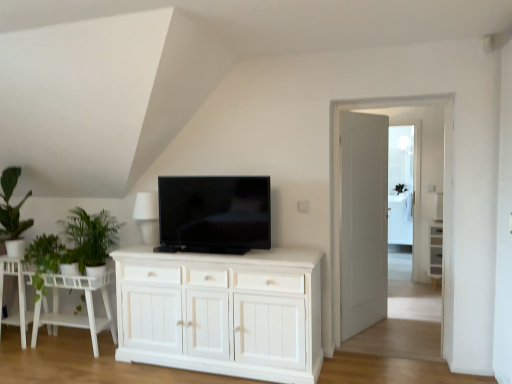
This screenshot has height=384, width=512. I want to click on space that is in front of transparent glass door at center, the first glass door when ordered from left to right, so click(x=406, y=365).